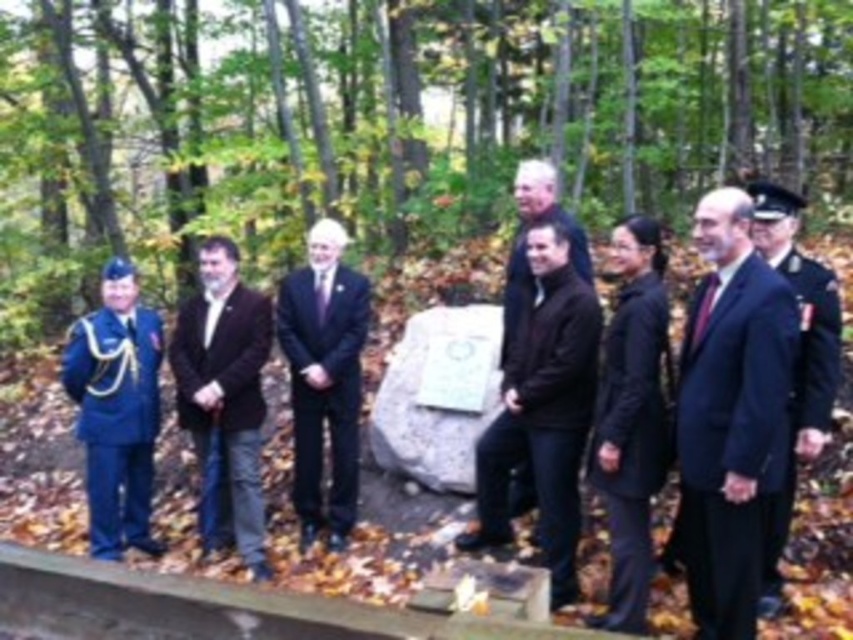
Question: Can you confirm if dark blue suit at center is positioned above blue uniform at left?

Choices:
 (A) no
 (B) yes

Answer: (B)

Question: Estimate the real-world distances between objects in this image. Which object is farther from the black matte suit at center?

Choices:
 (A) black suit at center
 (B) dark brown leather jacket at center
 (C) blue uniform at left

Answer: (C)

Question: Can you confirm if blue uniform at left is thinner than navy blue uniform at center?

Choices:
 (A) no
 (B) yes

Answer: (A)

Question: Which object is positioned farthest from the black matte suit at center?

Choices:
 (A) black matte jacket at center
 (B) dark blue suit at center
 (C) black suit at center

Answer: (C)

Question: Is dark blue suit at center thinner than black suit at center?

Choices:
 (A) no
 (B) yes

Answer: (B)

Question: Which of these objects is positioned closest to the navy blue uniform at center?

Choices:
 (A) black matte jacket at center
 (B) dark brown leather jacket at center
 (C) black suit at center
 (D) dark blue suit at center

Answer: (D)